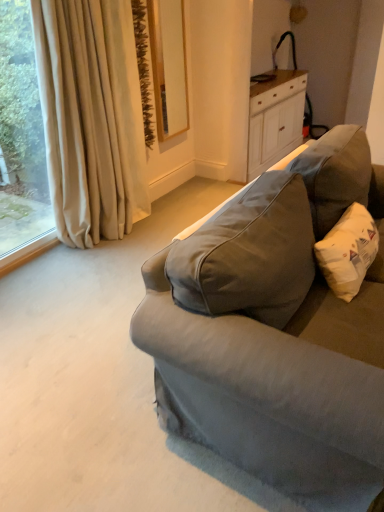
Question: Does beige fabric curtain at left lie behind matte gray fabric couch at right?

Choices:
 (A) yes
 (B) no

Answer: (A)

Question: Is beige fabric curtain at left bigger than matte gray fabric couch at right?

Choices:
 (A) no
 (B) yes

Answer: (A)

Question: Could you tell me if beige fabric curtain at left is turned towards matte gray fabric couch at right?

Choices:
 (A) no
 (B) yes

Answer: (B)

Question: Considering the relative sizes of beige fabric curtain at left and matte gray fabric couch at right in the image provided, is beige fabric curtain at left thinner than matte gray fabric couch at right?

Choices:
 (A) yes
 (B) no

Answer: (A)

Question: Is beige fabric curtain at left positioned with its back to matte gray fabric couch at right?

Choices:
 (A) no
 (B) yes

Answer: (A)

Question: Considering the relative sizes of beige fabric curtain at left and matte gray fabric couch at right in the image provided, is beige fabric curtain at left taller than matte gray fabric couch at right?

Choices:
 (A) yes
 (B) no

Answer: (A)

Question: Can you confirm if white cotton pillow at right is bigger than beige curtain at left?

Choices:
 (A) no
 (B) yes

Answer: (A)

Question: Is white cotton pillow at right oriented away from beige curtain at left?

Choices:
 (A) yes
 (B) no

Answer: (A)

Question: Can beige curtain at left be found inside white cotton pillow at right?

Choices:
 (A) yes
 (B) no

Answer: (B)

Question: From a real-world perspective, is white cotton pillow at right under beige curtain at left?

Choices:
 (A) yes
 (B) no

Answer: (A)

Question: Is the position of white cotton pillow at right less distant than that of beige curtain at left?

Choices:
 (A) yes
 (B) no

Answer: (A)

Question: From the image's perspective, is white cotton pillow at right located above beige curtain at left?

Choices:
 (A) yes
 (B) no

Answer: (B)

Question: Would you say white cotton pillow at right is a long distance from white wood cabinet at upper right?

Choices:
 (A) yes
 (B) no

Answer: (A)